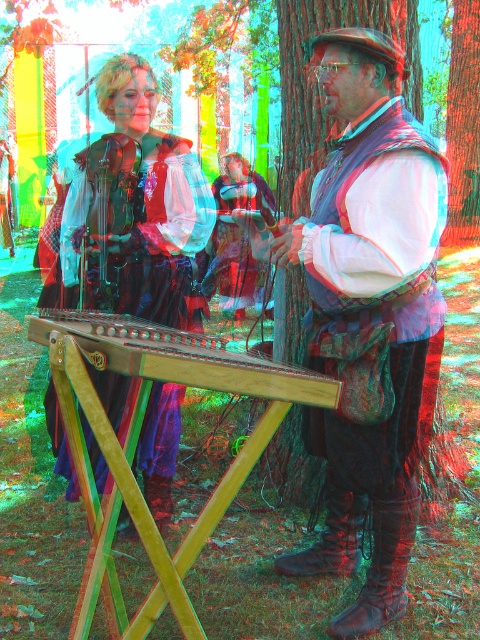
Question: Can you confirm if matte black dress at center is bigger than green textured tree at center?

Choices:
 (A) no
 (B) yes

Answer: (A)

Question: Which of the following is the farthest from the observer?

Choices:
 (A) green textured tree at center
 (B) matte brown vest at center

Answer: (A)

Question: Which object is the farthest from the green textured tree at center?

Choices:
 (A) velvet blue vest at center
 (B) matte brown vest at center

Answer: (B)

Question: Does matte black dress at center have a lesser width compared to green textured tree at center?

Choices:
 (A) no
 (B) yes

Answer: (B)

Question: Does wooden stringed instrument at center appear over green textured tree at center?

Choices:
 (A) yes
 (B) no

Answer: (B)

Question: Which of the following is the closest to the observer?

Choices:
 (A) velvet blue vest at center
 (B) matte black dress at center
 (C) green textured tree at center

Answer: (B)